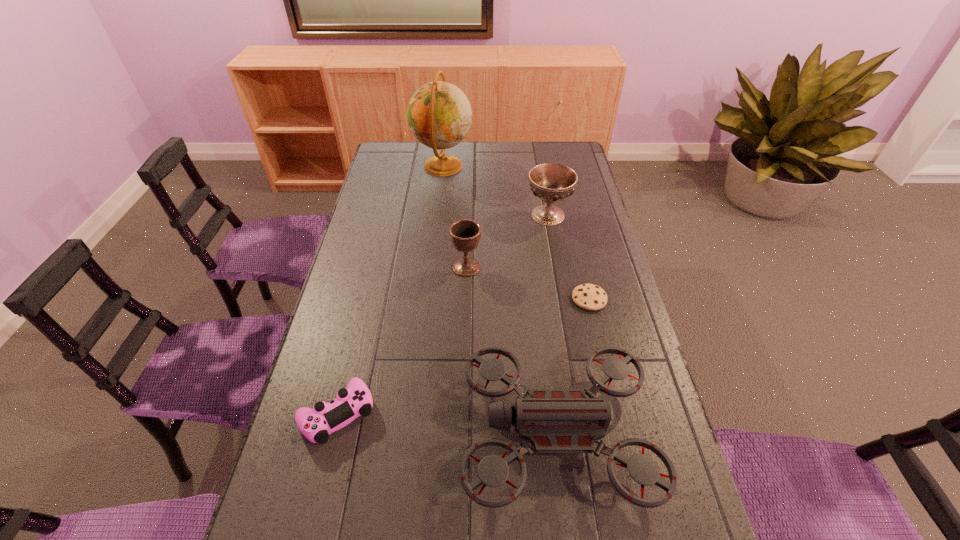
What are the coordinates of `free location that satisfies the following two spatial constraints: 1. on the front side of the left chalice; 2. on the left side of the globe` in the screenshot? It's located at (432, 267).